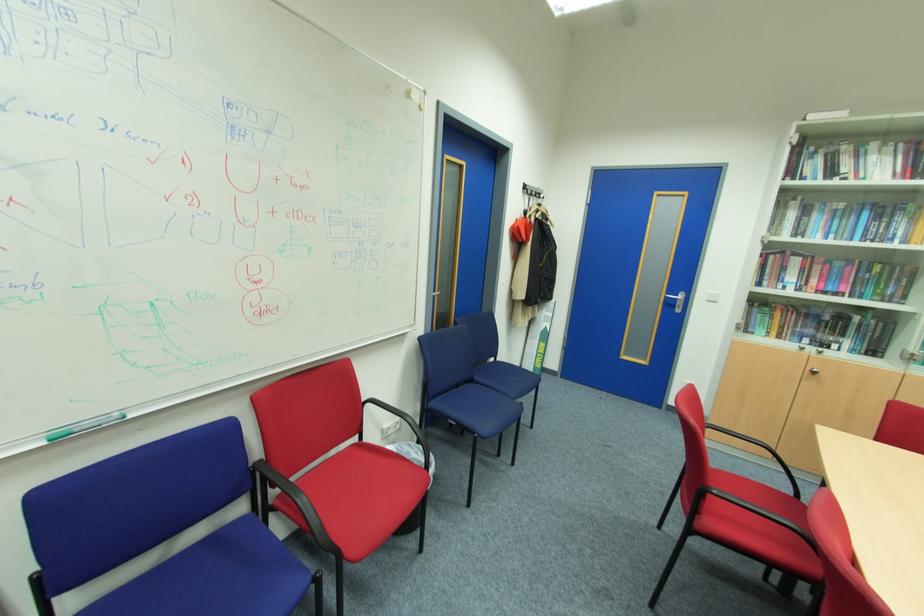
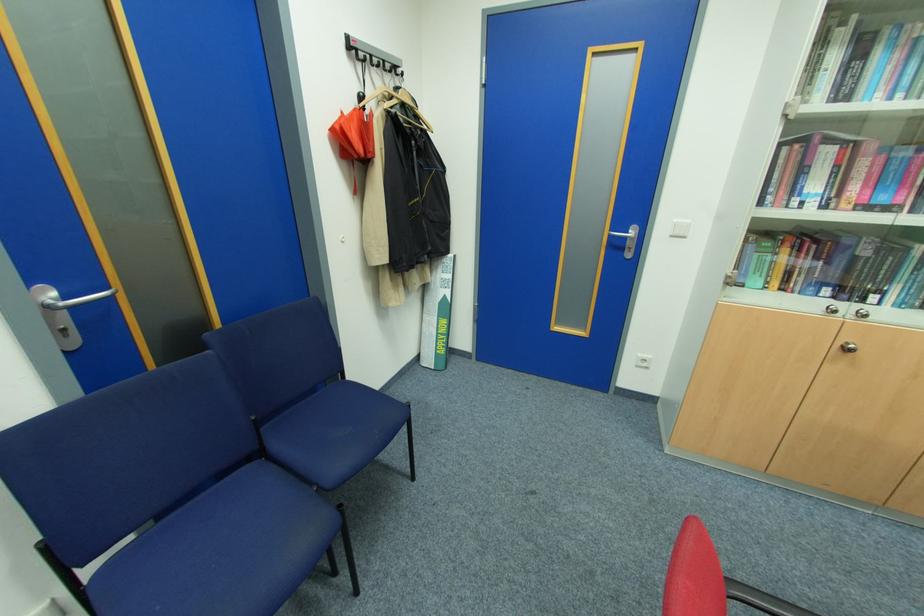
Locate, in the second image, the point that corresponds to point (519, 225) in the first image.

(341, 127)